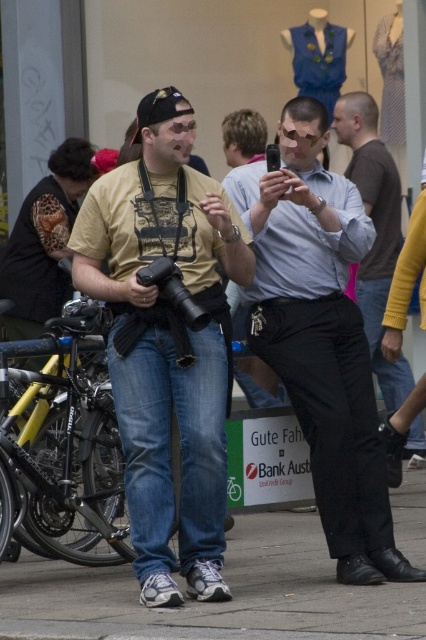
How distant is matte yellow t-shirt at center from matte blue shirt at center?

matte yellow t-shirt at center and matte blue shirt at center are 25.67 inches apart from each other.

Does point (75, 253) come in front of point (308, 317)?

Yes, it is in front of point (308, 317).

The image size is (426, 640). Identify the location of matte yellow t-shirt at center. (166, 342).

Does concrete sidewalk at center have a lesser height compared to black leather pants at right?

Yes, concrete sidewalk at center is shorter than black leather pants at right.

Which is more to the left, concrete sidewalk at center or black leather pants at right?

concrete sidewalk at center

Does point (108, 586) come behind point (377, 180)?

No, (108, 586) is in front of (377, 180).

Identify the location of concrete sidewalk at center. (215, 604).

Is matte blue shirt at center below black leather pants at right?

Yes.

Where is `matte blue shirt at center`? Image resolution: width=426 pixels, height=640 pixels. matte blue shirt at center is located at coordinates tap(321, 337).

Identify the location of matte blue shirt at center. This screenshot has height=640, width=426. (321, 337).

At what (x,y) coordinates should I click in order to perform the action: click on matte blue shirt at center. Please return your answer as a coordinate pair (x, y). The height and width of the screenshot is (640, 426). Looking at the image, I should click on click(321, 337).